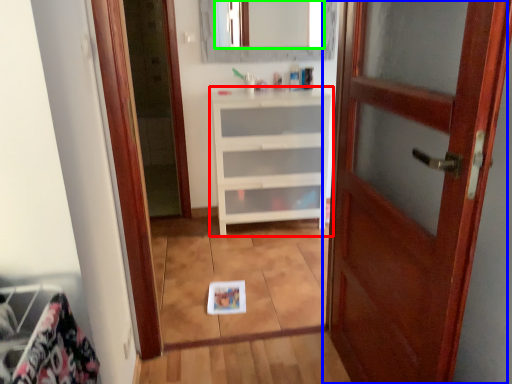
Question: Estimate the real-world distances between objects in this image. Which object is closer to chest of drawers (highlighted by a red box), door (highlighted by a blue box) or mirror (highlighted by a green box)?

Choices:
 (A) door
 (B) mirror

Answer: (A)